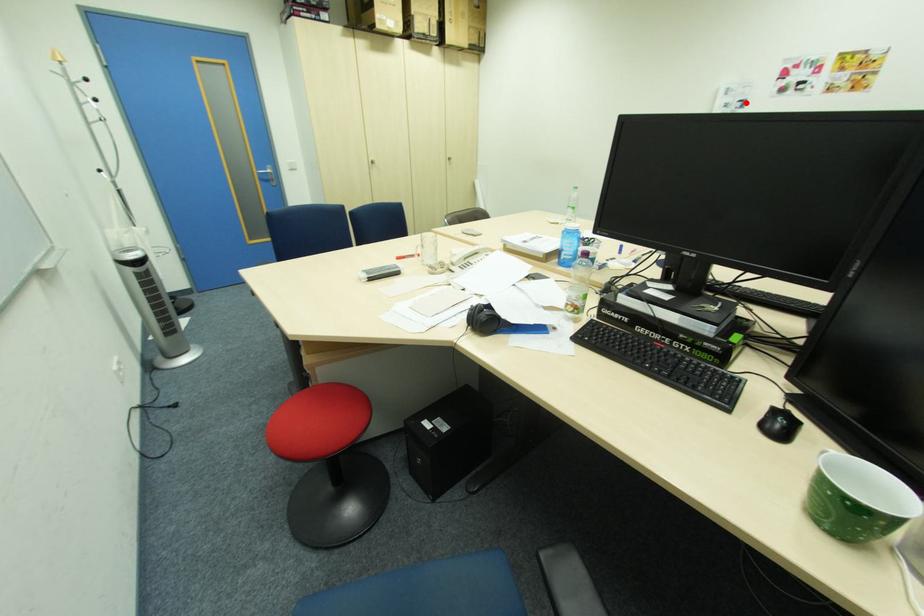
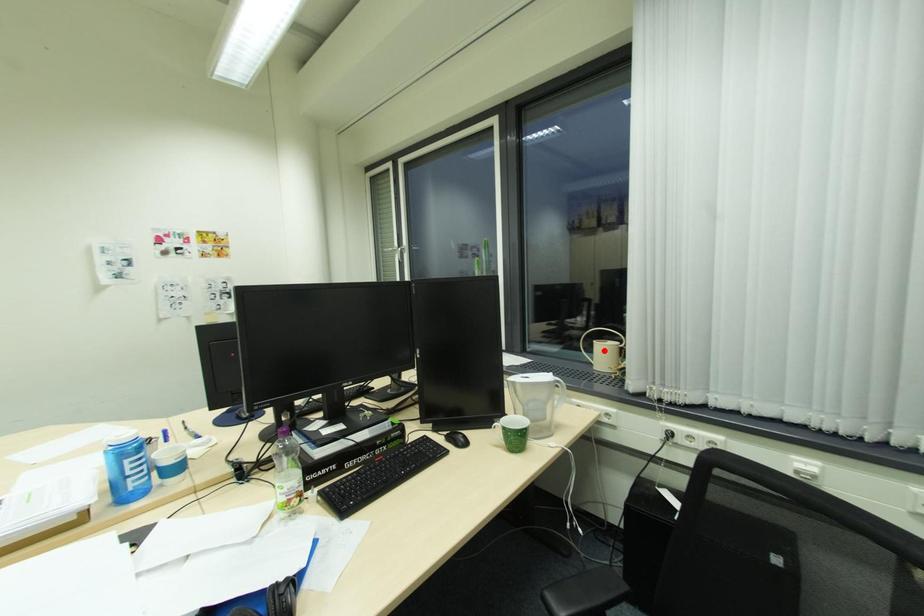
I am providing you with two images of the same scene from different viewpoints. A red point is marked on the first image and another point is marked on the second image. Do the highlighted points in image1 and image2 indicate the same real-world spot?

No